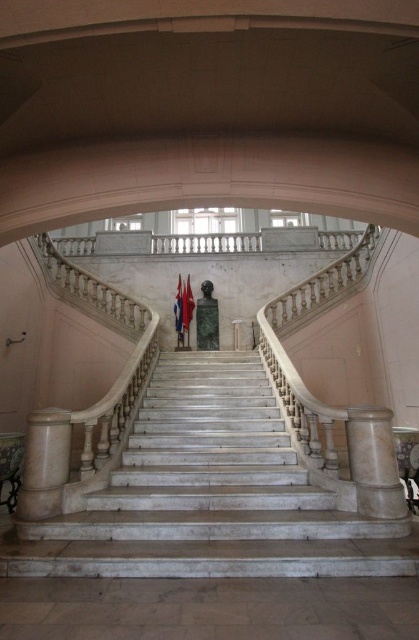
Based on the photo, you are an interior designer planning to place a large sculpture in this space. The sculpture requires a base that is at least as large as the white marble staircase at center. Can the white marble pillar at lower right accommodate this sculpture? Please explain your reasoning based on the provided information.

The white marble staircase at center is bigger than the white marble pillar at lower right. Since the sculpture requires a base at least as large as the staircase, the pillar is not large enough to accommodate it.

In the scene shown: You are an interior designer planning to place a large sculpture in the area. The sculpture requires a space larger than the white marble pillar at lower left. Based on the image, can the white marble staircase at center accommodate the sculpture?

The white marble staircase at center has a larger size compared to the white marble pillar at lower left, so yes, the white marble staircase at center can accommodate the sculpture.

You are standing at the entrance of the building and want to locate the white marble staircase at center. According to the coordinates provided, where should you look relative to your position?

You should look towards the center of the room at coordinates point (209,493) to find the white marble staircase at center.